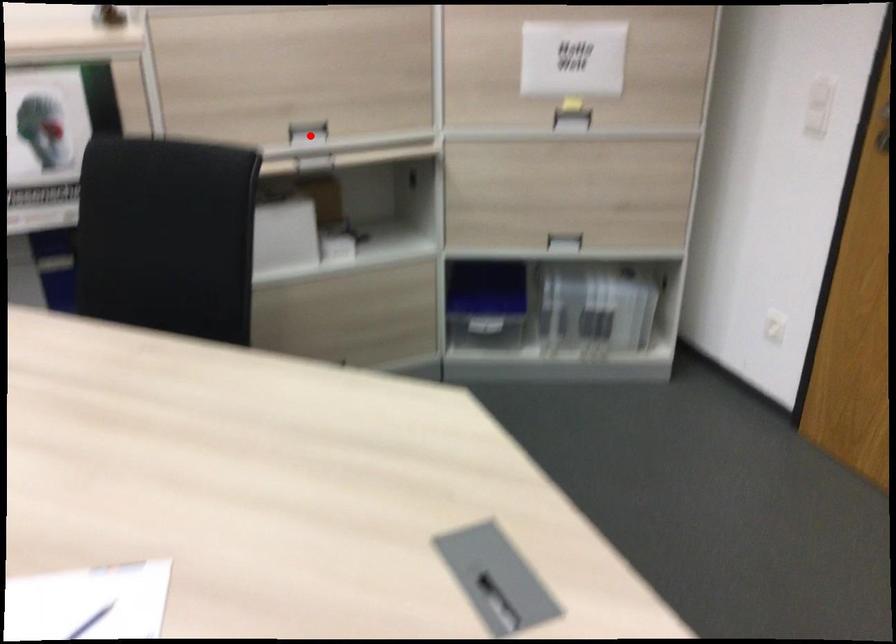
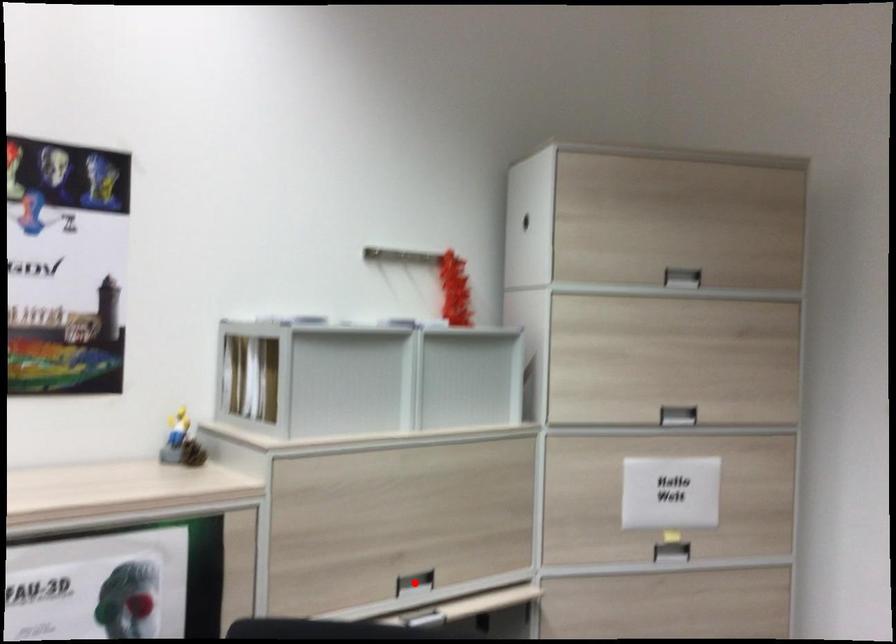
I am providing you with two images of the same scene from different viewpoints. A red point is marked on the first image and another point is marked on the second image. Are the points marked in image1 and image2 representing the same 3D position?

Yes